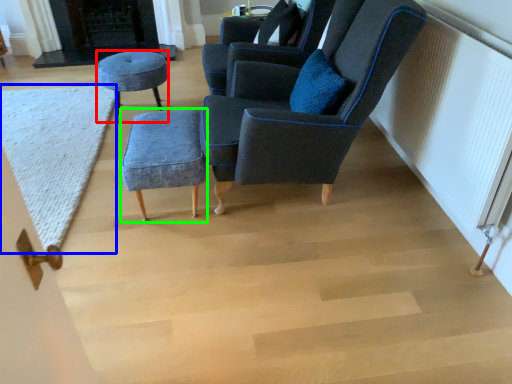
Question: Based on their relative distances, which object is farther from stool (highlighted by a red box)? Choose from mat (highlighted by a blue box) and stool (highlighted by a green box).

Choices:
 (A) mat
 (B) stool

Answer: (B)